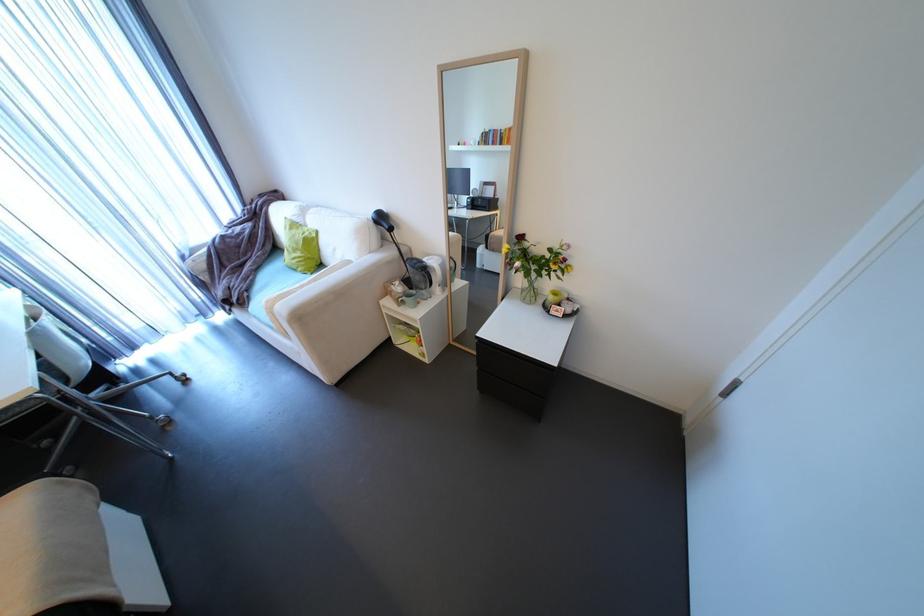
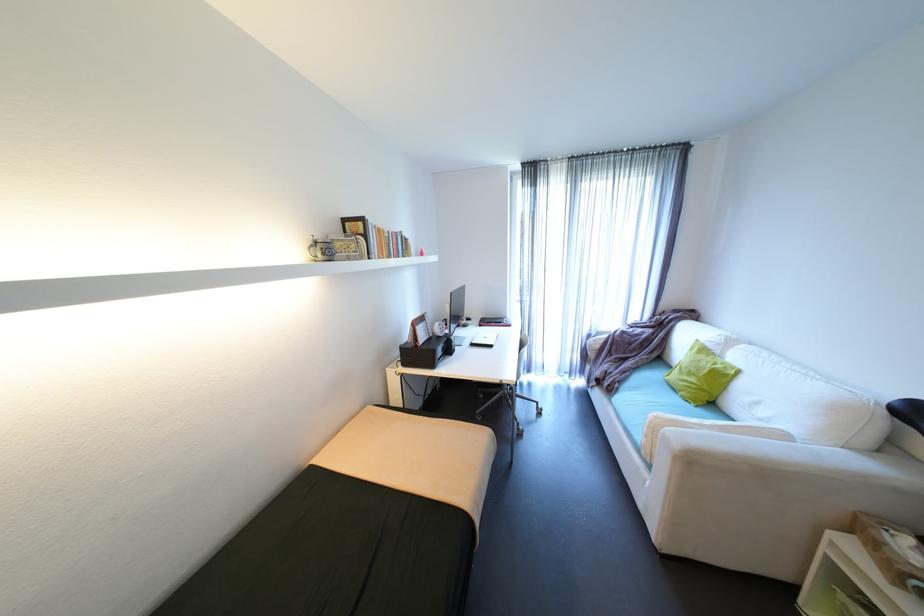
Locate, in the second image, the point that corresponds to point 395,262 in the first image.

(907, 493)